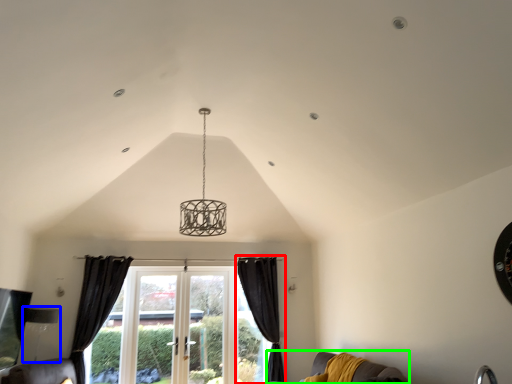
Question: Based on their relative distances, which object is nearer to curtain (highlighted by a red box)? Choose from lamp (highlighted by a blue box) and couch (highlighted by a green box).

Choices:
 (A) lamp
 (B) couch

Answer: (B)